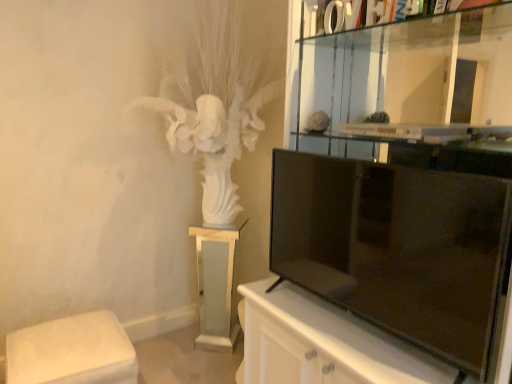
Question: Is black glossy tv at right to the left of white fabric ottoman at lower left, the 1th furniture positioned from the front, from the viewer's perspective?

Choices:
 (A) yes
 (B) no

Answer: (B)

Question: Considering the relative positions of black glossy tv at right and white fabric ottoman at lower left, the 2th furniture when ordered from right to left, in the image provided, is black glossy tv at right behind white fabric ottoman at lower left, the 2th furniture when ordered from right to left,?

Choices:
 (A) yes
 (B) no

Answer: (B)

Question: From the image's perspective, is black glossy tv at right below white fabric ottoman at lower left, the 1th furniture positioned from the front?

Choices:
 (A) no
 (B) yes

Answer: (A)

Question: Is black glossy tv at right positioned in front of white fabric ottoman at lower left, the 1th furniture positioned from the front?

Choices:
 (A) no
 (B) yes

Answer: (B)

Question: Considering the relative sizes of black glossy tv at right and white fabric ottoman at lower left, the 2th furniture when ordered from right to left, in the image provided, is black glossy tv at right wider than white fabric ottoman at lower left, the 2th furniture when ordered from right to left,?

Choices:
 (A) no
 (B) yes

Answer: (A)

Question: Considering the positions of black glossy tv at right and white fabric ottoman at lower left, arranged as the second furniture when viewed from the back, in the image, is black glossy tv at right taller or shorter than white fabric ottoman at lower left, arranged as the second furniture when viewed from the back,?

Choices:
 (A) short
 (B) tall

Answer: (B)

Question: Is black glossy tv at right wider or thinner than white fabric ottoman at lower left, arranged as the second furniture when viewed from the back?

Choices:
 (A) wide
 (B) thin

Answer: (B)

Question: Relative to white fabric ottoman at lower left, the 2th furniture when ordered from right to left, is black glossy tv at right in front or behind?

Choices:
 (A) front
 (B) behind

Answer: (A)

Question: Considering the positions of black glossy tv at right and white fabric ottoman at lower left, the 1th furniture positioned from the front, in the image, is black glossy tv at right bigger or smaller than white fabric ottoman at lower left, the 1th furniture positioned from the front,?

Choices:
 (A) small
 (B) big

Answer: (A)

Question: From the image's perspective, is white fabric ottoman at lower left, the 1th furniture positioned from the front, located above or below black glossy tv at right?

Choices:
 (A) below
 (B) above

Answer: (A)

Question: Looking at the image, does white fabric ottoman at lower left, arranged as the second furniture when viewed from the back, seem bigger or smaller compared to black glossy tv at right?

Choices:
 (A) small
 (B) big

Answer: (B)

Question: Is white fabric ottoman at lower left, the 2th furniture when ordered from right to left, spatially inside black glossy tv at right, or outside of it?

Choices:
 (A) inside
 (B) outside

Answer: (B)

Question: In the image, is white fabric ottoman at lower left, the 2th furniture when ordered from right to left, on the left side or the right side of black glossy tv at right?

Choices:
 (A) right
 (B) left

Answer: (B)

Question: From the image's perspective, is white fabric ottoman at lower left, the 1th furniture positioned from the front, above or below white frosted glass pedestal at center, which is the 1th furniture from back to front?

Choices:
 (A) above
 (B) below

Answer: (B)

Question: Visually, is white fabric ottoman at lower left, arranged as the second furniture when viewed from the back, positioned to the left or to the right of white frosted glass pedestal at center, the 1th furniture positioned from the right?

Choices:
 (A) left
 (B) right

Answer: (A)